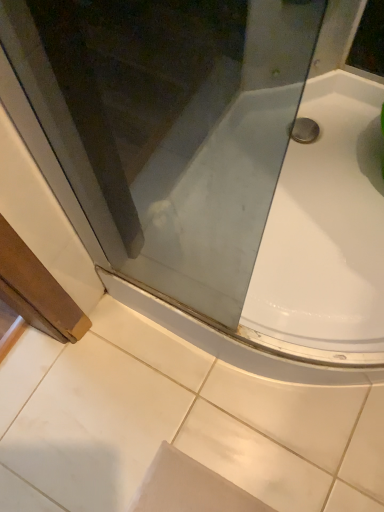
At what (x,y) coordinates should I click in order to perform the action: click on white glossy ceramic tile at lower center. Please return your answer as a coordinate pair (x, y). Looking at the image, I should click on (175, 423).

What do you see at coordinates (175, 423) in the screenshot? I see `white glossy ceramic tile at lower center` at bounding box center [175, 423].

You are a GUI agent. You are given a task and a screenshot of the screen. Output one action in this format:
    pyautogui.click(x=<x>, y=<y>)
    Task: Click on the white glossy ceramic tile at lower center
    Image resolution: width=384 pixels, height=512 pixels.
    Given the screenshot: What is the action you would take?
    pyautogui.click(x=175, y=423)